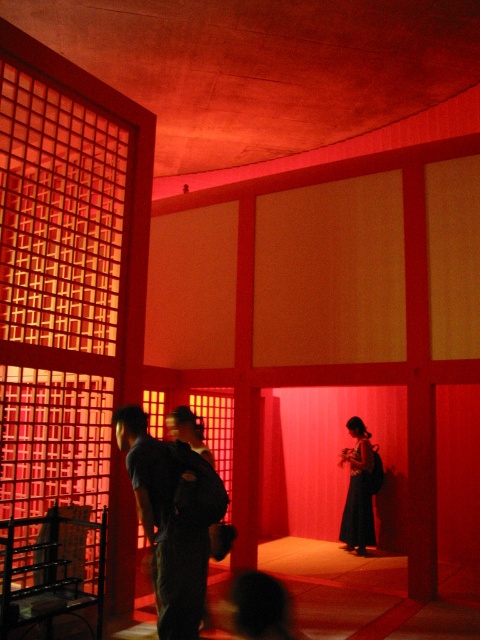
Who is more forward, (14, 109) or (363, 442)?

Positioned in front is point (14, 109).

Does translucent bamboo curtain at left have a greater height compared to black silk dress at center?

Yes, translucent bamboo curtain at left is taller than black silk dress at center.

Who is more forward, (0,198) or (354,490)?

Point (0,198)

Where is `translucent bamboo curtain at left`? This screenshot has width=480, height=640. translucent bamboo curtain at left is located at coordinates (62, 301).

Where is `dark blue fabric backpack at center`? The width and height of the screenshot is (480, 640). dark blue fabric backpack at center is located at coordinates point(171,518).

Who is more distant from viewer, (142, 419) or (372, 458)?

The point (372, 458) is behind.

Find the location of a particular element. The height and width of the screenshot is (640, 480). dark blue fabric backpack at center is located at coordinates (171, 518).

Between translucent bamboo curtain at left and dark blue fabric backpack at center, which one appears on the right side from the viewer's perspective?

dark blue fabric backpack at center

Is point (44, 296) less distant than point (121, 422)?

No.

In order to click on translucent bamboo curtain at left in this screenshot , I will do (x=62, y=301).